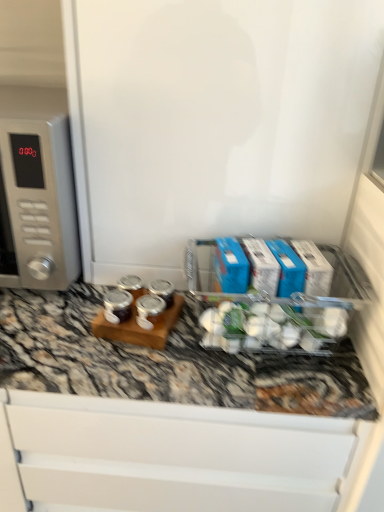
Question: In terms of size, does clear plastic container at center appear bigger or smaller than satin silver microwave at left?

Choices:
 (A) small
 (B) big

Answer: (A)

Question: From the image's perspective, is clear plastic container at center above or below satin silver microwave at left?

Choices:
 (A) above
 (B) below

Answer: (B)

Question: Visually, is clear plastic container at center positioned to the left or to the right of satin silver microwave at left?

Choices:
 (A) right
 (B) left

Answer: (A)

Question: Do you think satin silver microwave at left is within clear plastic container at center, or outside of it?

Choices:
 (A) inside
 (B) outside

Answer: (B)

Question: Is satin silver microwave at left in front of or behind clear plastic container at center in the image?

Choices:
 (A) behind
 (B) front

Answer: (A)

Question: Considering the positions of satin silver microwave at left and clear plastic container at center in the image, is satin silver microwave at left bigger or smaller than clear plastic container at center?

Choices:
 (A) small
 (B) big

Answer: (B)

Question: Is satin silver microwave at left to the left or to the right of clear plastic container at center in the image?

Choices:
 (A) right
 (B) left

Answer: (B)